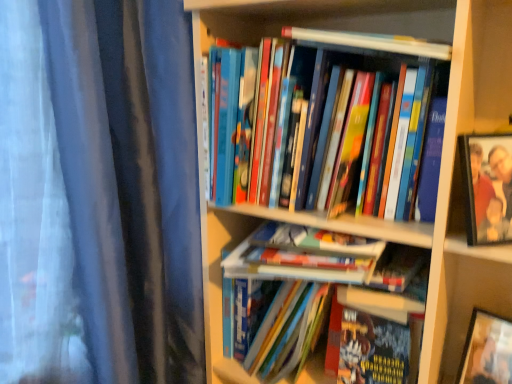
Question: Do you think hardcover books at center, which is the 2th book in top-to-bottom order, is within hardcover book at center, the 6th book from the top, or outside of it?

Choices:
 (A) outside
 (B) inside

Answer: (A)

Question: Considering the relative positions of hardcover books at center, acting as the 5th book starting from the bottom, and hardcover book at center, the 6th book from the top, in the image provided, is hardcover books at center, acting as the 5th book starting from the bottom, to the left or to the right of hardcover book at center, the 6th book from the top,?

Choices:
 (A) right
 (B) left

Answer: (B)

Question: Which object is positioned closest to the wooden bookshelf at center?

Choices:
 (A) hardcover books at center, acting as the 5th book starting from the bottom
 (B) hardcover books at center, which ranks as the 3th book in bottom-to-top order
 (C) hardcover book at center, the 4th book positioned from the bottom
 (D) hardcover book at upper center, which appears as the 1th book when viewed from the top
 (E) metallic silver photo frame at upper right

Answer: (A)

Question: Based on their relative distances, which object is farther from the hardcover book at center, the 1th book in the bottom-to-top sequence?

Choices:
 (A) wooden bookshelf at center
 (B) hardcover book at center, the 3th book from the top
 (C) hardcover book at upper center, the sixth book positioned from the bottom
 (D) hardcover books at center, which ranks as the 3th book in bottom-to-top order
 (E) hardcover books at center, acting as the 5th book starting from the bottom

Answer: (C)